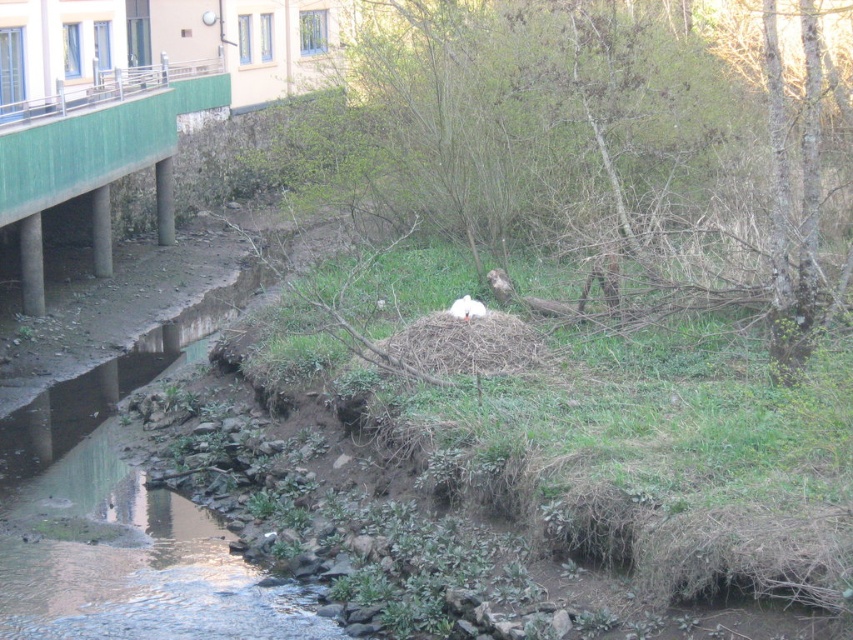
You are standing at the edge of the stream in the image. If you want to reach the brown textured nest at center, in which direction should you move relative to your current position?

The brown textured nest at center is located at point coordinates 0.239 on the x axis and 0.713 on the y axis. Since you are at the edge of the stream in the foreground, which is lower in the image, you would need to move towards the upper part of the image to reach it. In terms of coordinates, moving towards higher y values would bring you closer to the nest. Therefore, you should move upwards relative to your current position at the stream edge.

You are standing at the edge of the stream in the image. A brown textured nest at center is located at point (607, 152). If you want to reach the nest without getting your feet wet, which direction should you walk from your current position?

The brown textured nest at center is located at point (607, 152), so you should walk towards that coordinate to reach it without entering the water.

You are standing at the edge of the stream and want to reach both the point at coordinates point [698,154] and the point at coordinates point [457,298]. Which point is closer to you?

Point [698,154] is closer to you because it is further to the viewer than point [457,298].